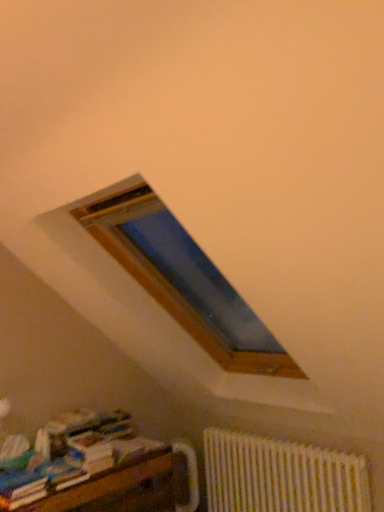
Question: Is white textured radiator at lower right positioned with its back to multicolored paper at lower left?

Choices:
 (A) yes
 (B) no

Answer: (B)

Question: Is white textured radiator at lower right to the right of multicolored paper at lower left from the viewer's perspective?

Choices:
 (A) yes
 (B) no

Answer: (A)

Question: Are white textured radiator at lower right and multicolored paper at lower left located far from each other?

Choices:
 (A) yes
 (B) no

Answer: (A)

Question: From a real-world perspective, is white textured radiator at lower right positioned over multicolored paper at lower left based on gravity?

Choices:
 (A) yes
 (B) no

Answer: (B)

Question: Does white textured radiator at lower right appear on the left side of multicolored paper at lower left?

Choices:
 (A) no
 (B) yes

Answer: (A)

Question: Does white textured radiator at lower right have a greater width compared to multicolored paper at lower left?

Choices:
 (A) yes
 (B) no

Answer: (B)

Question: From a real-world perspective, does multicolored paper at lower left stand above white textured radiator at lower right?

Choices:
 (A) yes
 (B) no

Answer: (A)

Question: Considering the relative sizes of multicolored paper at lower left and white textured radiator at lower right in the image provided, is multicolored paper at lower left smaller than white textured radiator at lower right?

Choices:
 (A) no
 (B) yes

Answer: (B)

Question: Is multicolored paper at lower left to the left of white textured radiator at lower right from the viewer's perspective?

Choices:
 (A) yes
 (B) no

Answer: (A)

Question: Is multicolored paper at lower left further to the viewer compared to white textured radiator at lower right?

Choices:
 (A) yes
 (B) no

Answer: (B)

Question: Is multicolored paper at lower left facing towards white textured radiator at lower right?

Choices:
 (A) yes
 (B) no

Answer: (B)

Question: From a real-world perspective, is multicolored paper at lower left beneath white textured radiator at lower right?

Choices:
 (A) yes
 (B) no

Answer: (B)

Question: Is white textured radiator at lower right oriented towards wooden bookshelf at lower left?

Choices:
 (A) no
 (B) yes

Answer: (B)